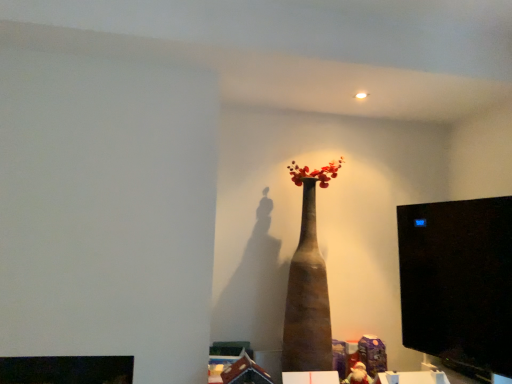
Question: From a real-world perspective, relative to brown matte vase at center, is black glossy monitor at right vertically above or below?

Choices:
 (A) below
 (B) above

Answer: (A)

Question: From the image's perspective, is black glossy monitor at right located above or below brown matte vase at center?

Choices:
 (A) above
 (B) below

Answer: (A)

Question: In terms of size, does black glossy monitor at right appear bigger or smaller than brown matte vase at center?

Choices:
 (A) big
 (B) small

Answer: (B)

Question: From the image's perspective, is brown matte vase at center positioned above or below black glossy monitor at right?

Choices:
 (A) above
 (B) below

Answer: (B)

Question: Considering the positions of brown matte vase at center and black glossy monitor at right in the image, is brown matte vase at center wider or thinner than black glossy monitor at right?

Choices:
 (A) thin
 (B) wide

Answer: (B)

Question: From their relative heights in the image, would you say brown matte vase at center is taller or shorter than black glossy monitor at right?

Choices:
 (A) tall
 (B) short

Answer: (A)

Question: Considering the positions of point (307, 327) and point (455, 256), is point (307, 327) closer or farther from the camera than point (455, 256)?

Choices:
 (A) closer
 (B) farther

Answer: (B)